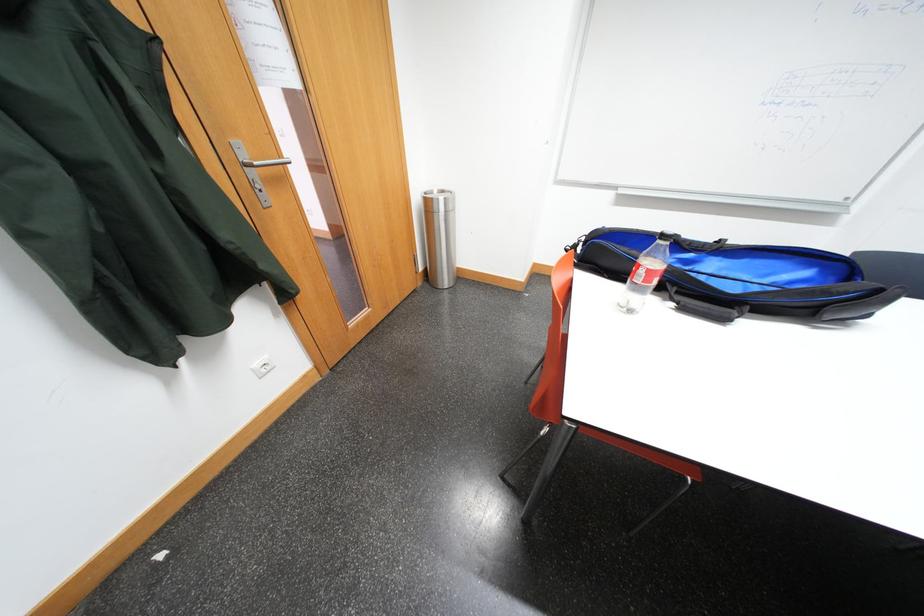
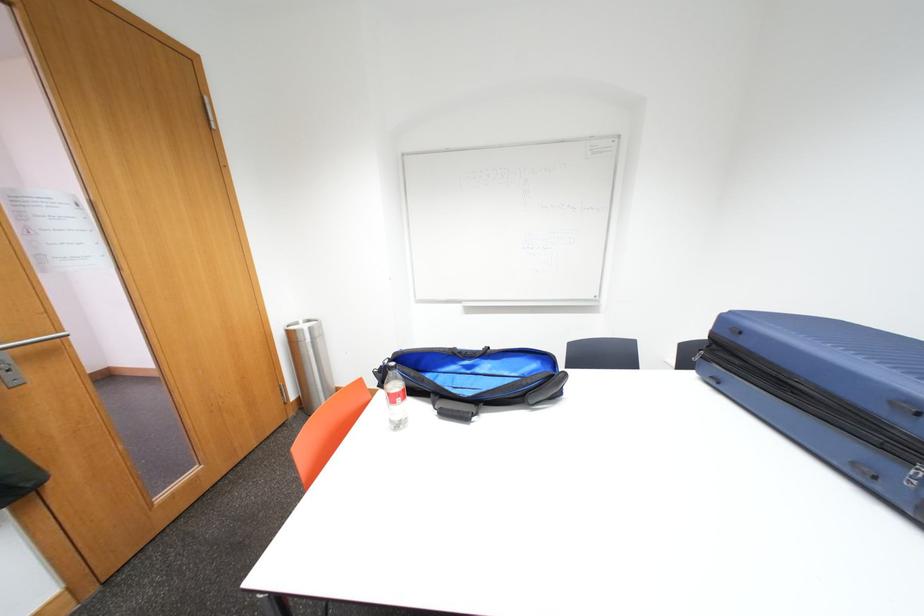
The first image is from the beginning of the video and the second image is from the end. How did the camera likely rotate when shooting the video?

The camera's rotation is toward right-up.